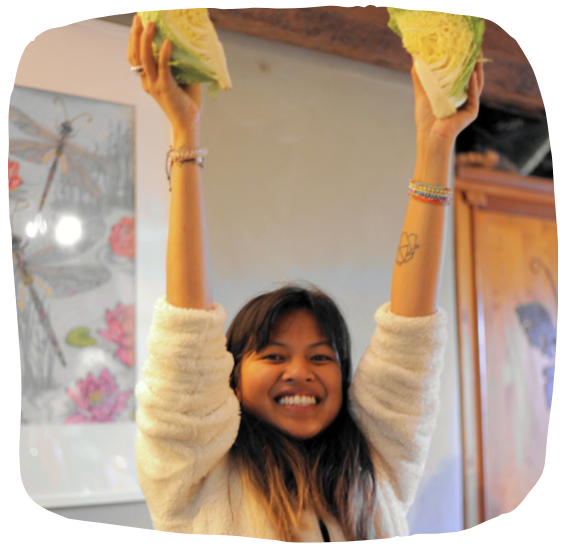
Locate an element on the screen. Image resolution: width=564 pixels, height=546 pixels. wooden ceiling is located at coordinates (360, 23).